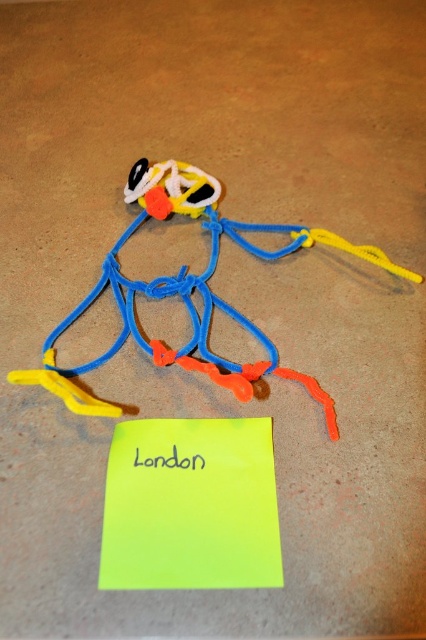
Does point (118, 307) come behind point (173, 448)?

Yes, point (118, 307) is farther from viewer.

Does point (164, 349) lie behind point (144, 460)?

Yes, point (164, 349) is behind point (144, 460).

You are a GUI agent. You are given a task and a screenshot of the screen. Output one action in this format:
    pyautogui.click(x=<x>, y=<y>)
    Task: Click on the flexible plastic toy at center
    This screenshot has height=640, width=426.
    Given the screenshot: What is the action you would take?
    pyautogui.click(x=187, y=292)